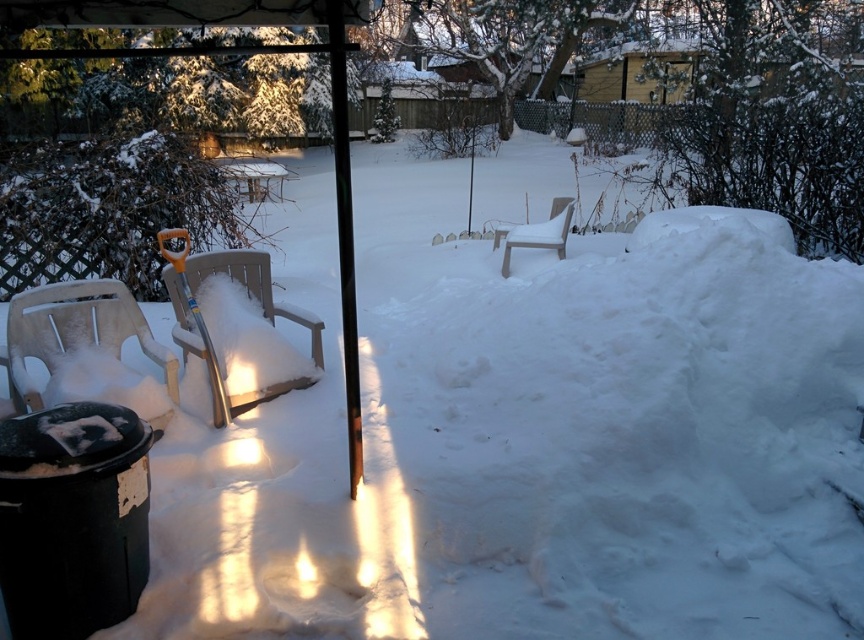
Is teal plastic shovel at center shorter than white plastic chair at center?

Incorrect, teal plastic shovel at center's height does not fall short of white plastic chair at center's.

Is teal plastic shovel at center smaller than white plastic chair at center?

Indeed, teal plastic shovel at center has a smaller size compared to white plastic chair at center.

The height and width of the screenshot is (640, 864). What are the coordinates of `teal plastic shovel at center` in the screenshot? It's located at (195, 314).

Who is positioned more to the right, wooden chair at center-left or plastic chair at left?

wooden chair at center-left is more to the right.

Is wooden chair at center-left shorter than plastic chair at left?

No.

Identify the location of wooden chair at center-left. The height and width of the screenshot is (640, 864). (236, 332).

Image resolution: width=864 pixels, height=640 pixels. In order to click on wooden chair at center-left in this screenshot , I will do `click(236, 332)`.

Is point (202, 365) positioned after point (551, 204)?

No, it is in front of (551, 204).

Can you confirm if wooden chair at center-left is positioned above white plastic chair at center?

No, wooden chair at center-left is not above white plastic chair at center.

Is point (283, 376) more distant than point (558, 237)?

That is False.

Where is `wooden chair at center-left`? wooden chair at center-left is located at coordinates (236, 332).